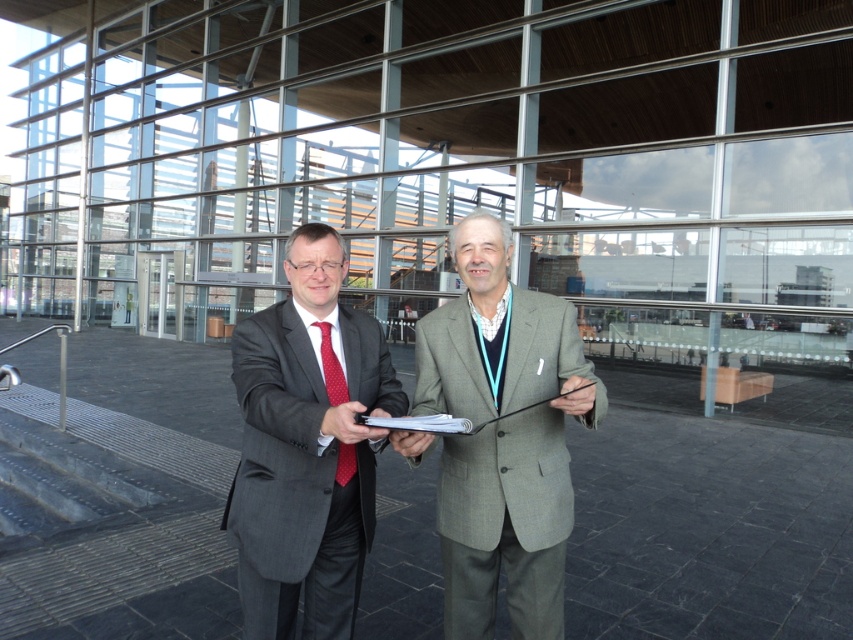
Question: Does matte gray suit at center appear on the right side of red dotted tie at center?

Choices:
 (A) no
 (B) yes

Answer: (A)

Question: Which of the following is the closest to the observer?

Choices:
 (A) (332, 387)
 (B) (281, 440)

Answer: (B)

Question: Considering the real-world distances, which object is closest to the gray wool suit at center?

Choices:
 (A) red dotted tie at center
 (B) matte gray suit at center

Answer: (B)

Question: Can you confirm if gray wool suit at center is positioned to the left of red dotted tie at center?

Choices:
 (A) no
 (B) yes

Answer: (A)

Question: Which point appears farthest from the camera in this image?

Choices:
 (A) (335, 385)
 (B) (283, 627)

Answer: (B)

Question: Does matte gray suit at center have a lesser width compared to red dotted tie at center?

Choices:
 (A) yes
 (B) no

Answer: (B)